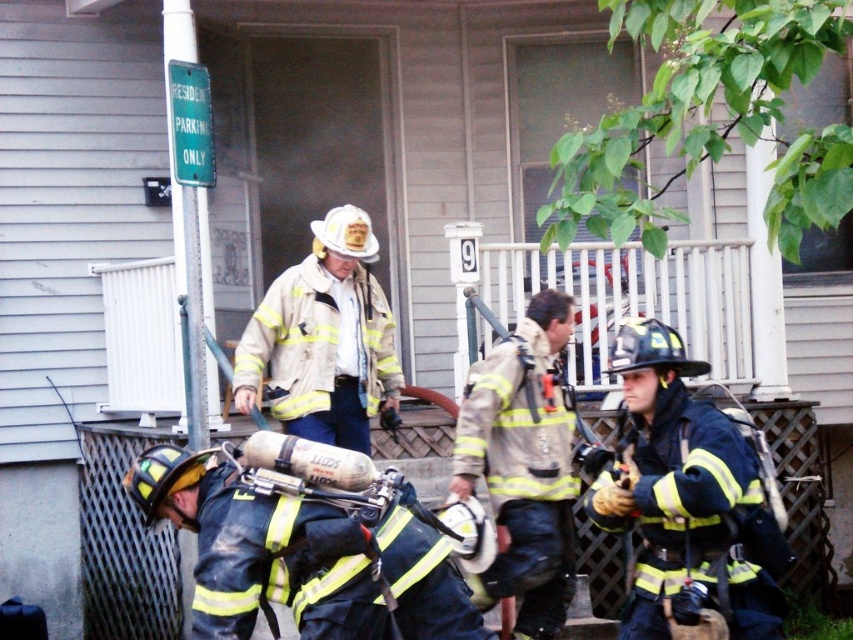
Question: Among these objects, which one is farthest from the camera?

Choices:
 (A) white matte helmet at center
 (B) dark blue uniform at center
 (C) reflective silver helmet at center
 (D) reflective black fireman at lower left

Answer: (A)

Question: Based on their relative distances, which object is farther from the white matte helmet at center?

Choices:
 (A) reflective black fireman at lower left
 (B) dark blue uniform at center
 (C) reflective silver helmet at center

Answer: (A)

Question: Which is farther from the reflective silver helmet at center?

Choices:
 (A) reflective black fireman at lower left
 (B) white matte helmet at center
 (C) dark blue uniform at center

Answer: (A)

Question: Observing the image, what is the correct spatial positioning of reflective black fireman at lower left in reference to white matte helmet at center?

Choices:
 (A) left
 (B) right

Answer: (B)

Question: Where is reflective silver helmet at center located in relation to white matte helmet at center in the image?

Choices:
 (A) left
 (B) right

Answer: (B)

Question: Can you confirm if reflective black fireman at lower left is positioned below white matte helmet at center?

Choices:
 (A) yes
 (B) no

Answer: (A)